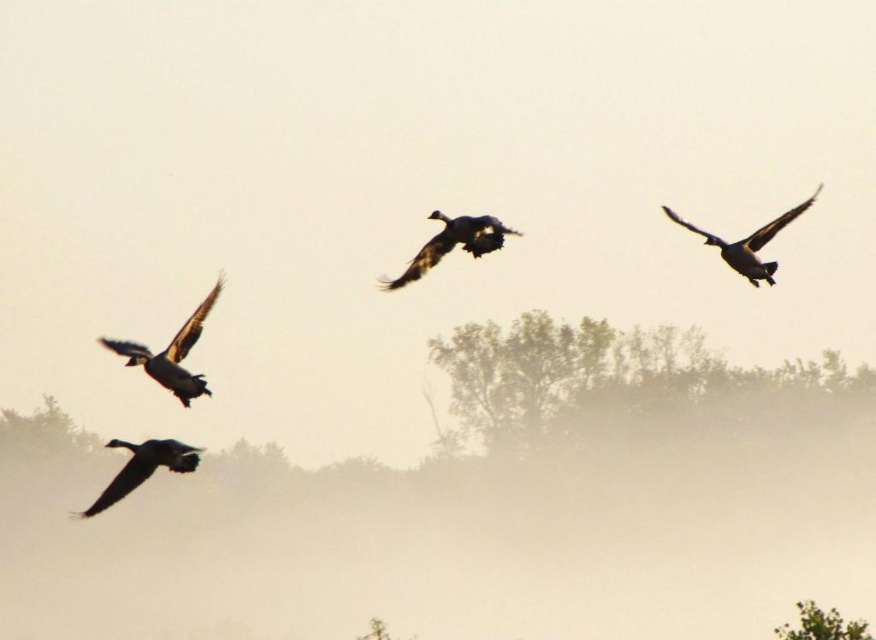
Question: Can you confirm if dark gray feathers at lower left is bigger than green leafy tree at lower right?

Choices:
 (A) no
 (B) yes

Answer: (B)

Question: Which of the following is the farthest from the observer?

Choices:
 (A) dark gray feathers at left
 (B) dark gray feathers at lower left

Answer: (B)

Question: Which is nearer to the dark gray feathers at center?

Choices:
 (A) dark gray feathers at upper right
 (B) green leafy tree at lower right
 (C) green leafy trees at lower center

Answer: (A)

Question: Observing the image, what is the correct spatial positioning of green leafy trees at lower center in reference to dark gray feathers at lower left?

Choices:
 (A) below
 (B) above

Answer: (A)

Question: Which point appears closest to the camera in this image?

Choices:
 (A) (178, 362)
 (B) (102, 490)
 (C) (761, 230)

Answer: (A)

Question: Can you confirm if dark gray feathers at left is positioned above dark gray feathers at lower left?

Choices:
 (A) yes
 (B) no

Answer: (A)